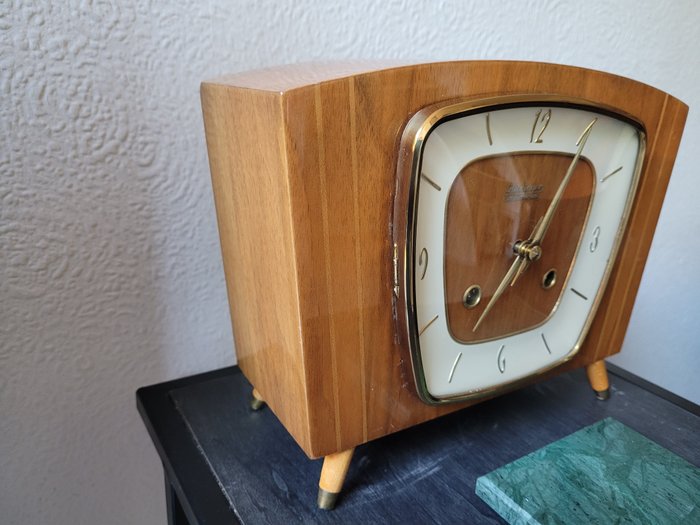
Locate an element on the screen. square green stone coaster is located at coordinates (621, 495).